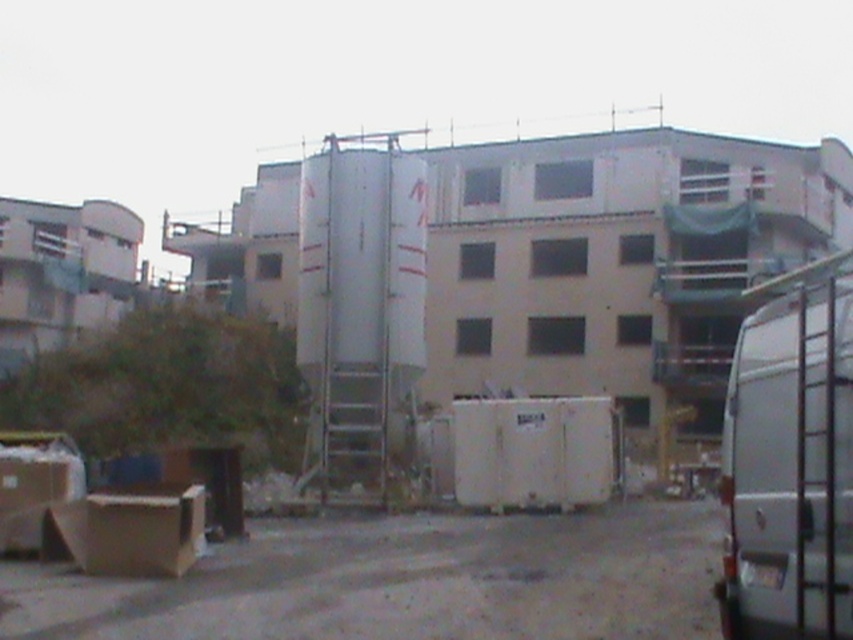
Question: Estimate the real-world distances between objects in this image. Which object is farther from the white matte van at right?

Choices:
 (A) brown dirt field at lower center
 (B) brown cardboard box at lower left

Answer: (B)

Question: Does white matte van at right have a greater width compared to brown cardboard box at lower left?

Choices:
 (A) yes
 (B) no

Answer: (A)

Question: Is white matte van at right smaller than brown cardboard box at lower left?

Choices:
 (A) no
 (B) yes

Answer: (A)

Question: Can you confirm if brown dirt field at lower center is thinner than white matte van at right?

Choices:
 (A) no
 (B) yes

Answer: (A)

Question: Based on their relative distances, which object is farther from the brown cardboard box at lower left?

Choices:
 (A) white matte van at right
 (B) brown dirt field at lower center

Answer: (A)

Question: Based on their relative distances, which object is nearer to the white matte van at right?

Choices:
 (A) brown dirt field at lower center
 (B) brown cardboard box at lower left

Answer: (A)